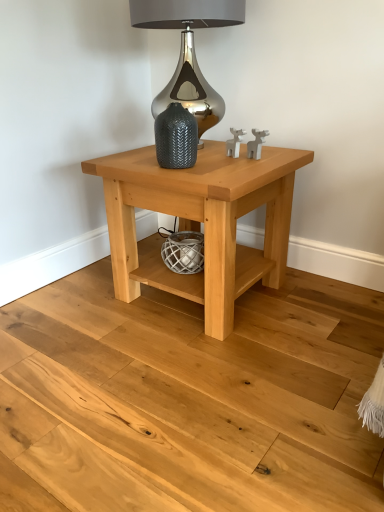
Question: Does natural wood table at center have a lesser width compared to textured gray vase at center?

Choices:
 (A) no
 (B) yes

Answer: (A)

Question: Does natural wood table at center have a greater width compared to textured gray vase at center?

Choices:
 (A) yes
 (B) no

Answer: (A)

Question: Does natural wood table at center come in front of textured gray vase at center?

Choices:
 (A) no
 (B) yes

Answer: (B)

Question: Are natural wood table at center and textured gray vase at center far apart?

Choices:
 (A) yes
 (B) no

Answer: (B)

Question: From a real-world perspective, is natural wood table at center positioned under textured gray vase at center based on gravity?

Choices:
 (A) no
 (B) yes

Answer: (B)

Question: Is point (180, 246) closer or farther from the camera than point (221, 106)?

Choices:
 (A) closer
 (B) farther

Answer: (A)

Question: Based on their positions, is white textured basket at lower center located to the left or right of satin silver lamp at upper center?

Choices:
 (A) right
 (B) left

Answer: (B)

Question: From their relative heights in the image, would you say white textured basket at lower center is taller or shorter than satin silver lamp at upper center?

Choices:
 (A) tall
 (B) short

Answer: (B)

Question: Considering their positions, is white textured basket at lower center located in front of or behind satin silver lamp at upper center?

Choices:
 (A) behind
 (B) front

Answer: (A)

Question: Considering the relative positions of natural wood table at center and satin silver lamp at upper center in the image provided, is natural wood table at center to the left or to the right of satin silver lamp at upper center?

Choices:
 (A) right
 (B) left

Answer: (A)

Question: Is natural wood table at center inside the boundaries of satin silver lamp at upper center, or outside?

Choices:
 (A) outside
 (B) inside

Answer: (A)

Question: Does point (153, 183) appear closer or farther from the camera than point (170, 82)?

Choices:
 (A) farther
 (B) closer

Answer: (B)

Question: In terms of width, does natural wood table at center look wider or thinner when compared to satin silver lamp at upper center?

Choices:
 (A) thin
 (B) wide

Answer: (B)

Question: Relative to satin silver lamp at upper center, is textured gray vase at center in front or behind?

Choices:
 (A) behind
 (B) front

Answer: (B)

Question: Considering the positions of point (162, 116) and point (134, 2), is point (162, 116) closer or farther from the camera than point (134, 2)?

Choices:
 (A) farther
 (B) closer

Answer: (B)